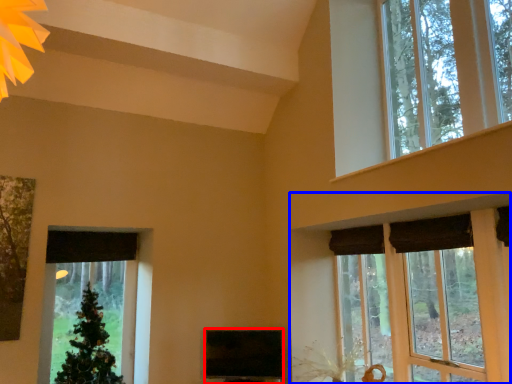
Question: Which object is closer to the camera taking this photo, window screen (highlighted by a red box) or window (highlighted by a blue box)?

Choices:
 (A) window screen
 (B) window

Answer: (B)